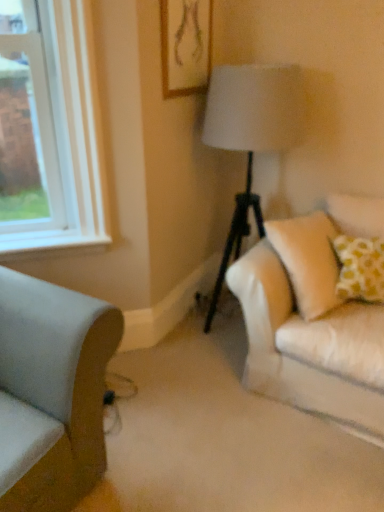
Question: Considering the positions of wooden framed artwork at upper center and light gray fabric couch at lower left in the image, is wooden framed artwork at upper center taller or shorter than light gray fabric couch at lower left?

Choices:
 (A) short
 (B) tall

Answer: (A)

Question: Is wooden framed artwork at upper center situated inside light gray fabric couch at lower left or outside?

Choices:
 (A) outside
 (B) inside

Answer: (A)

Question: Which object is the closest to the wooden framed artwork at upper center?

Choices:
 (A) light gray fabric couch at lower left
 (B) white smooth window sill at left

Answer: (B)

Question: Considering the real-world distances, which object is closest to the light gray fabric couch at lower left?

Choices:
 (A) wooden framed artwork at upper center
 (B) white smooth window sill at left

Answer: (B)